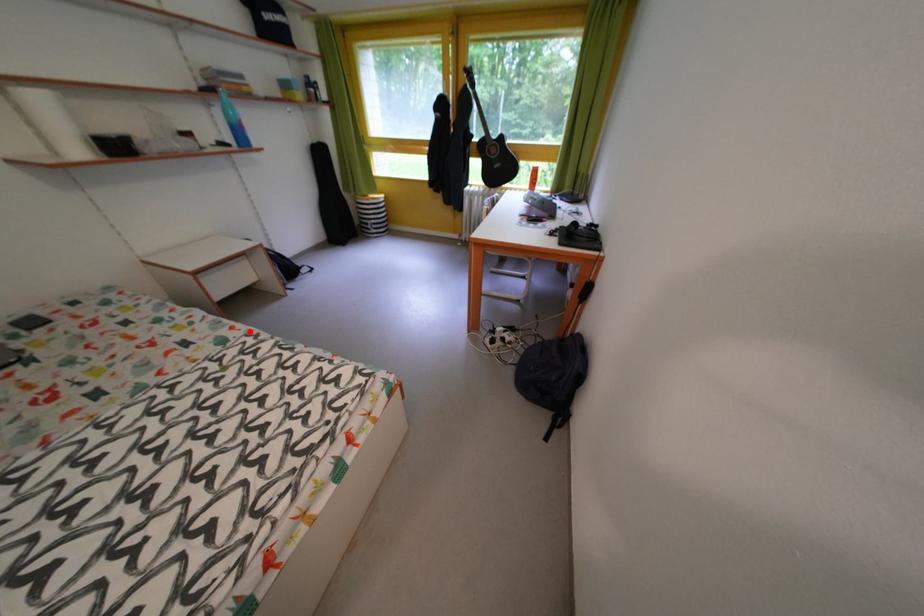
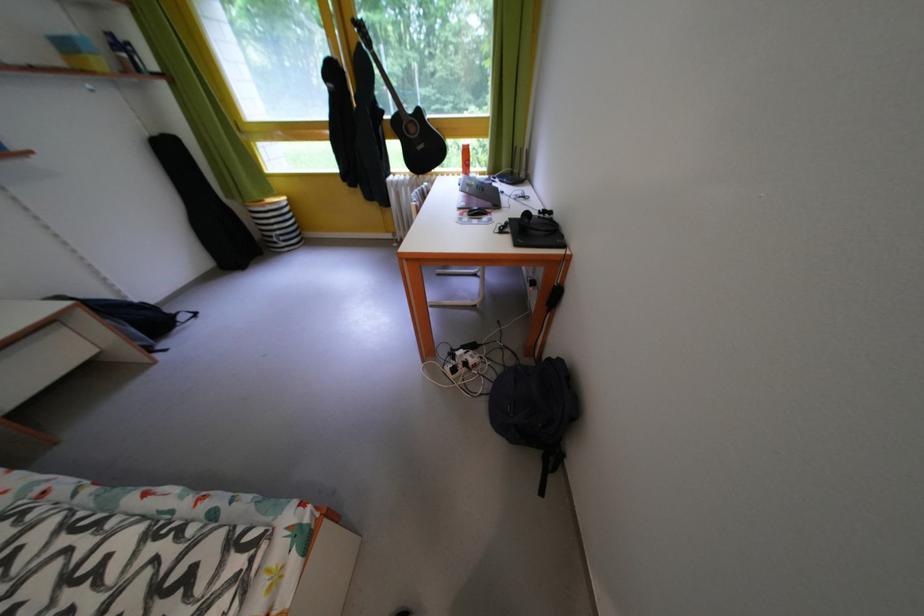
The point at the highlighted location is marked in the first image. Where is the corresponding point in the second image?

(23, 485)